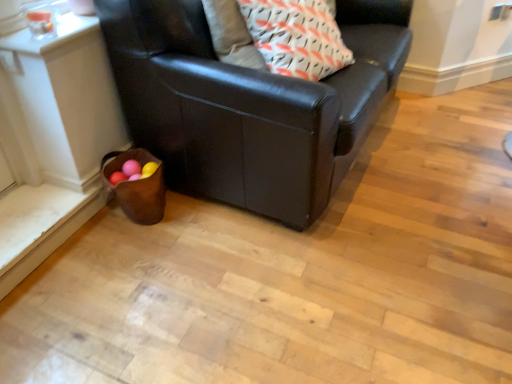
Question: From the image's perspective, relative to white with orange and black patterned pillow at upper center, is black leather couch at lower left above or below?

Choices:
 (A) above
 (B) below

Answer: (A)

Question: From a real-world perspective, is black leather couch at lower left positioned above or below white with orange and black patterned pillow at upper center?

Choices:
 (A) above
 (B) below

Answer: (B)

Question: Does point (376, 3) appear closer or farther from the camera than point (258, 46)?

Choices:
 (A) farther
 (B) closer

Answer: (A)

Question: From a real-world perspective, is white with orange and black patterned pillow at upper center above or below black leather couch at lower left?

Choices:
 (A) above
 (B) below

Answer: (A)

Question: Considering the positions of point (273, 39) and point (267, 132), is point (273, 39) closer or farther from the camera than point (267, 132)?

Choices:
 (A) farther
 (B) closer

Answer: (A)

Question: Would you say white with orange and black patterned pillow at upper center is to the left or to the right of black leather couch at lower left in the picture?

Choices:
 (A) left
 (B) right

Answer: (B)

Question: Considering the positions of white with orange and black patterned pillow at upper center and black leather couch at lower left in the image, is white with orange and black patterned pillow at upper center wider or thinner than black leather couch at lower left?

Choices:
 (A) wide
 (B) thin

Answer: (B)